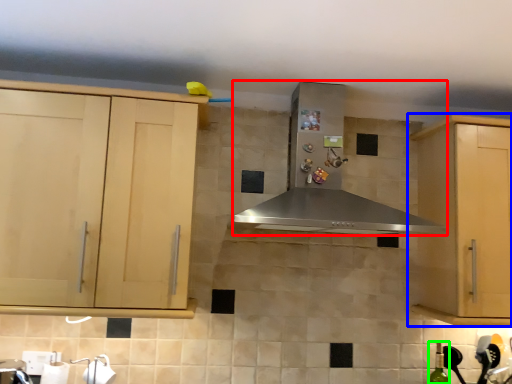
Question: Which object is positioned closest to home appliance (highlighted by a red box)? Select from cabinetry (highlighted by a blue box) and bottle (highlighted by a green box).

Choices:
 (A) cabinetry
 (B) bottle

Answer: (A)